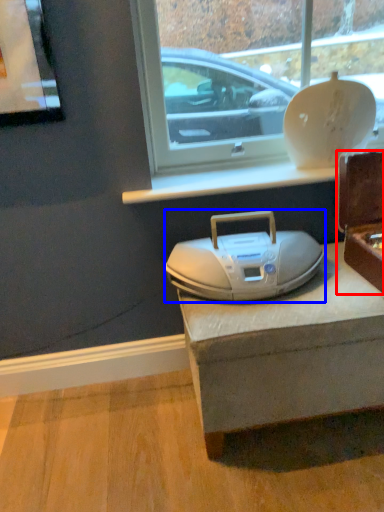
Question: Which object appears closest to the camera in this image, box (highlighted by a red box) or appliance (highlighted by a blue box)?

Choices:
 (A) box
 (B) appliance

Answer: (A)